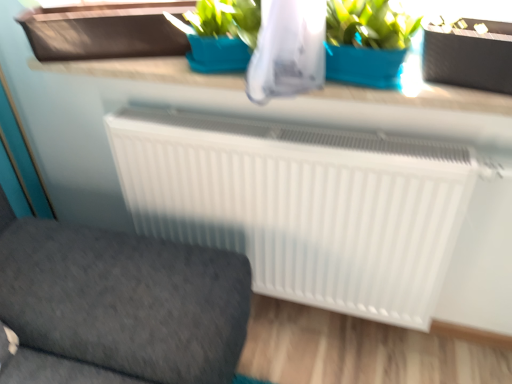
Question: Does point (153, 379) appear closer or farther from the camera than point (394, 124)?

Choices:
 (A) closer
 (B) farther

Answer: (A)

Question: Relative to white smooth counter top at upper center, is white plastic radiator at center in front or behind?

Choices:
 (A) behind
 (B) front

Answer: (B)

Question: Estimate the real-world distances between objects in this image. Which object is farther from the white plastic radiator at center?

Choices:
 (A) black matte flowerpot at upper right
 (B) white smooth counter top at upper center
 (C) brown matte window box at upper left

Answer: (A)

Question: Which object is the farthest from the black matte flowerpot at upper right?

Choices:
 (A) brown matte window box at upper left
 (B) white plastic radiator at center
 (C) white smooth counter top at upper center

Answer: (B)